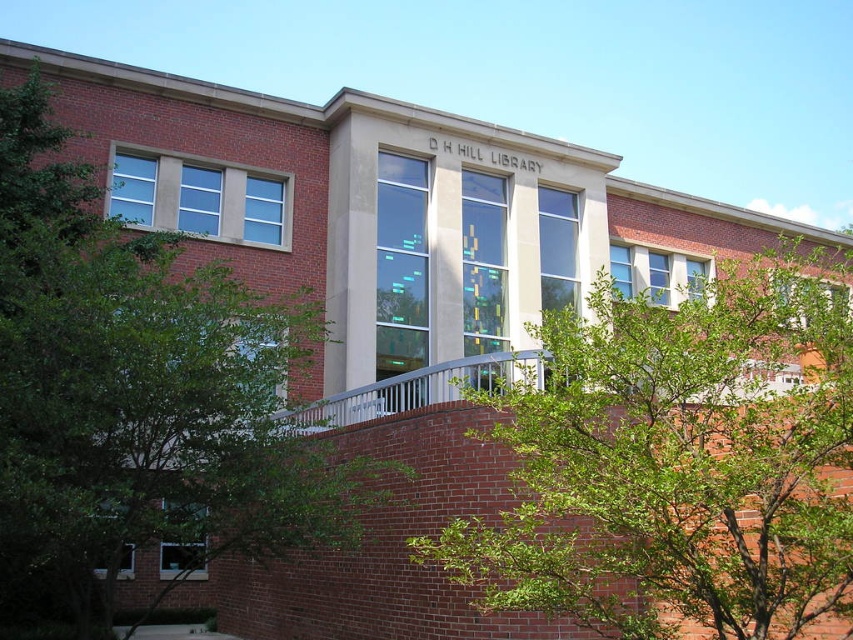
You are a visitor approaching the D.H. Hill Library and notice a green leafy tree at center and a white metal rail at center near the entrance. Which object is taller?

The green leafy tree at center is taller than the white metal rail at center.

You are standing in front of the D.H. Hill Library and want to walk towards the entrance. There is a green leafy tree at center and a white metal rail at center in your path. Which object should you avoid stepping over to stay on the correct path?

The green leafy tree at center is positioned on the right side of white metal rail at center. To stay on the correct path, you should avoid stepping over the white metal rail at center as it likely marks the boundary of the walkway.

You are standing in front of the D.H. Hill Library and want to take a photo of the green leafy tree at upper left and the white metal rail at center. Which object should you focus on first to ensure both are in the frame?

You should focus on the green leafy tree at upper left first because it is closer to the viewer than the white metal rail at center, so adjusting the camera to capture it ensures the rail will also be in the frame.